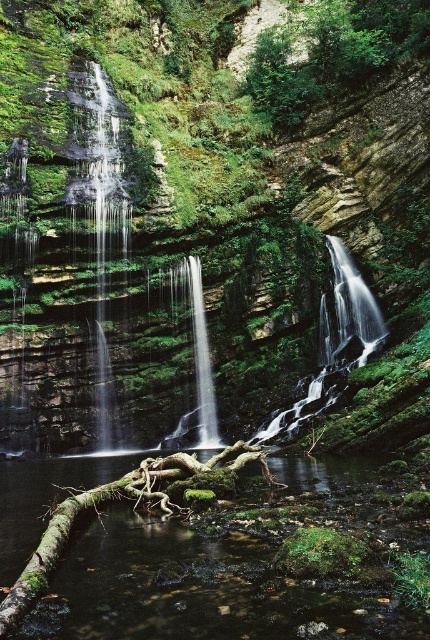
Can you confirm if green leafy tree at upper center is wider than translucent glass waterfall at center?

Correct, the width of green leafy tree at upper center exceeds that of translucent glass waterfall at center.

Locate an element on the screen. This screenshot has width=430, height=640. green leafy tree at upper center is located at coordinates (331, 52).

Is the position of green mossy log at center less distant than that of green leafy tree at upper center?

Yes.

Is green mossy log at center behind green leafy tree at upper center?

No, green mossy log at center is in front of green leafy tree at upper center.

Locate an element on the screen. green mossy log at center is located at coordinates (208, 552).

Measure the distance from green leafy tree at upper center to clear glass waterfall at center.

The distance of green leafy tree at upper center from clear glass waterfall at center is 51.64 feet.

Looking at this image, which is above, green leafy tree at upper center or clear glass waterfall at center?

Positioned higher is green leafy tree at upper center.

The image size is (430, 640). What are the coordinates of `green leafy tree at upper center` in the screenshot? It's located at (331, 52).